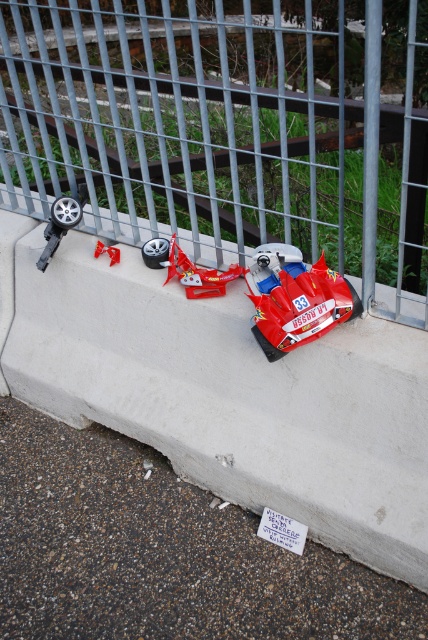
Who is taller, gray asphalt at lower center or shiny red car at center?

Standing taller between the two is gray asphalt at lower center.

Is gray asphalt at lower center closer to camera compared to shiny red car at center?

Yes, it is in front of shiny red car at center.

Is point (41, 596) behind point (196, 276)?

That is False.

This screenshot has height=640, width=428. In order to click on gray asphalt at lower center in this screenshot , I will do `click(162, 552)`.

Where is `metallic gray fence at upper center`? The height and width of the screenshot is (640, 428). metallic gray fence at upper center is located at coordinates (216, 120).

Does metallic gray fence at upper center have a greater height compared to gray asphalt at lower center?

Correct, metallic gray fence at upper center is much taller as gray asphalt at lower center.

Is point (287, 90) less distant than point (35, 588)?

No, it is not.

You are a GUI agent. You are given a task and a screenshot of the screen. Output one action in this format:
    pyautogui.click(x=<x>, y=<y>)
    Task: Click on the metallic gray fence at upper center
    This screenshot has width=428, height=640.
    Given the screenshot: What is the action you would take?
    pyautogui.click(x=216, y=120)

Does gray asphalt at lower center have a greater height compared to shiny red plastic toy car at lower right?

Indeed, gray asphalt at lower center has a greater height compared to shiny red plastic toy car at lower right.

How much distance is there between gray asphalt at lower center and shiny red plastic toy car at lower right?

gray asphalt at lower center is 31.09 inches away from shiny red plastic toy car at lower right.

This screenshot has width=428, height=640. I want to click on gray asphalt at lower center, so (162, 552).